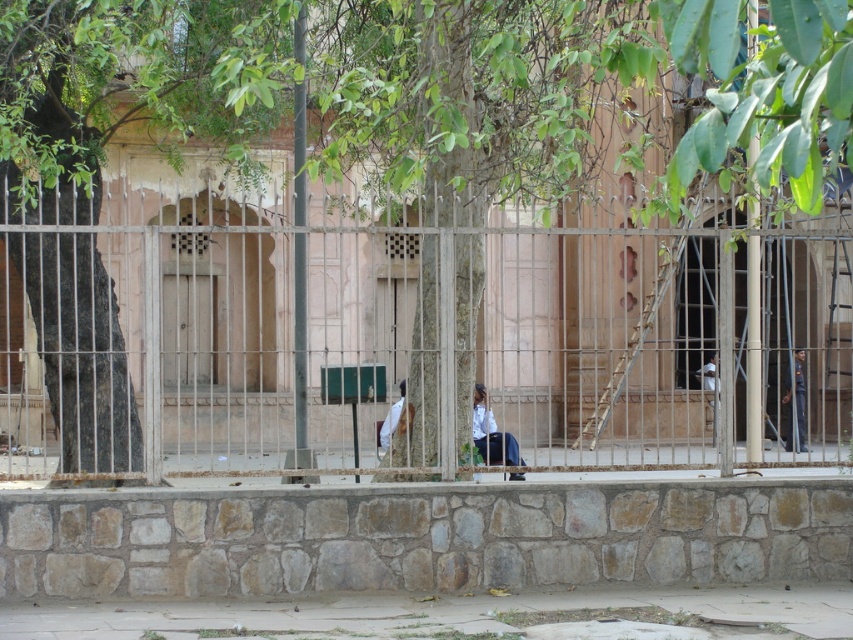
Question: Among these points, which one is farthest from the camera?

Choices:
 (A) (700, 385)
 (B) (415, 429)
 (C) (503, 440)

Answer: (A)

Question: Can you confirm if metallic silver fence at center is smaller than white fabric at center?

Choices:
 (A) yes
 (B) no

Answer: (B)

Question: Does metallic silver fence at center appear under dark blue uniform at right?

Choices:
 (A) yes
 (B) no

Answer: (B)

Question: Based on their relative distances, which object is farther from the metallic silver fence at center?

Choices:
 (A) dark blue uniform at right
 (B) white fabric at center

Answer: (A)

Question: Which object is positioned closest to the white fabric shirt at center?

Choices:
 (A) white fabric at center
 (B) dark blue uniform at right

Answer: (A)

Question: Can you confirm if dark blue uniform at right is wider than white fabric at center?

Choices:
 (A) yes
 (B) no

Answer: (B)